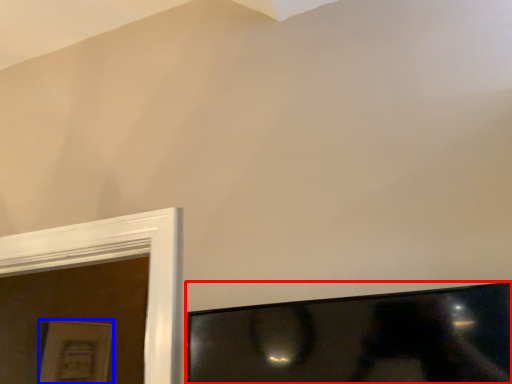
Question: Which point is further to the camera, television (highlighted by a red box) or picture frame (highlighted by a blue box)?

Choices:
 (A) television
 (B) picture frame

Answer: (B)